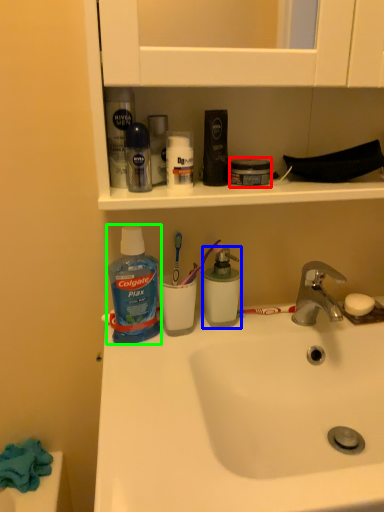
Question: Which object is the closest to the mouthwash (highlighted by a red box)? Choose among these: mouthwash (highlighted by a blue box) or cleaning product (highlighted by a green box).

Choices:
 (A) mouthwash
 (B) cleaning product

Answer: (A)